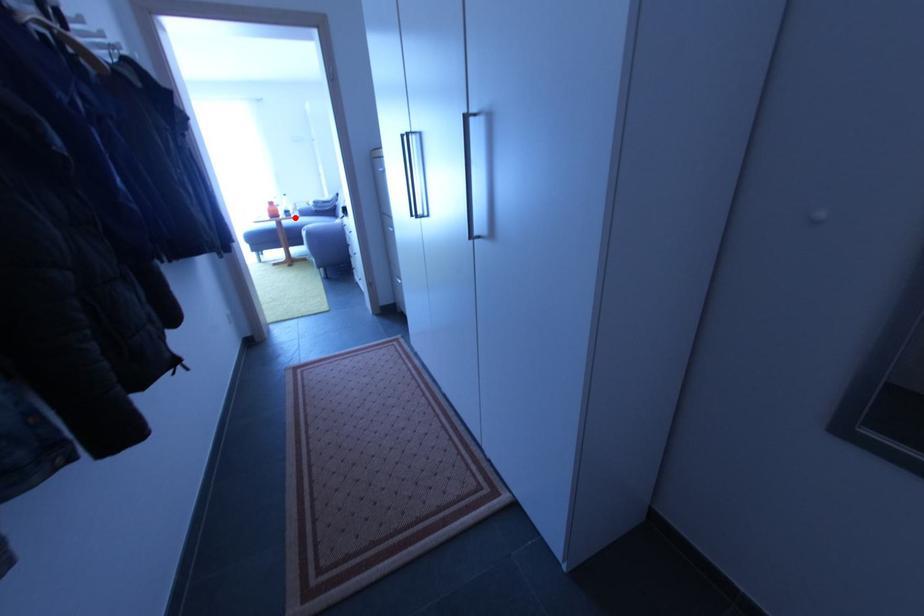
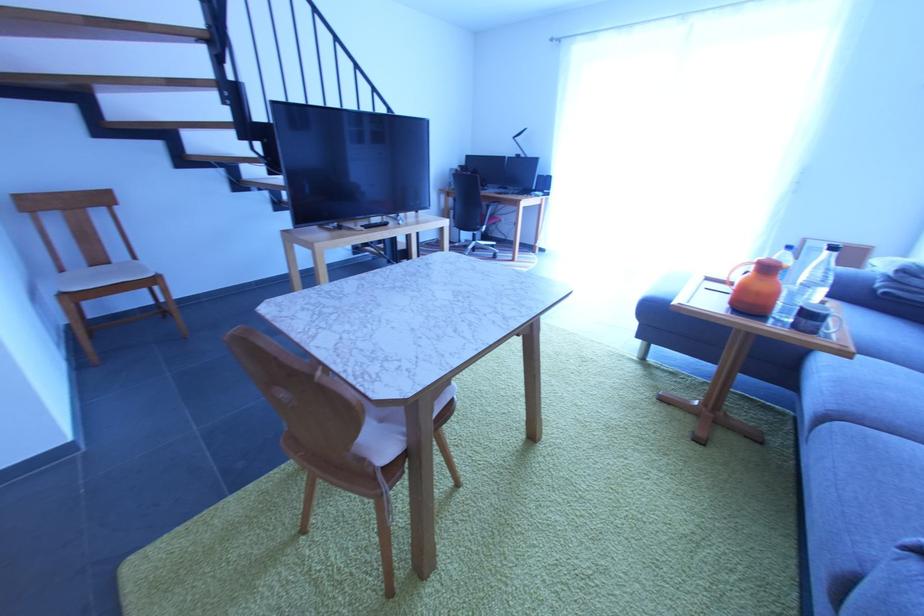
The point at the highlighted location is marked in the first image. Where is the corresponding point in the second image?

(819, 334)